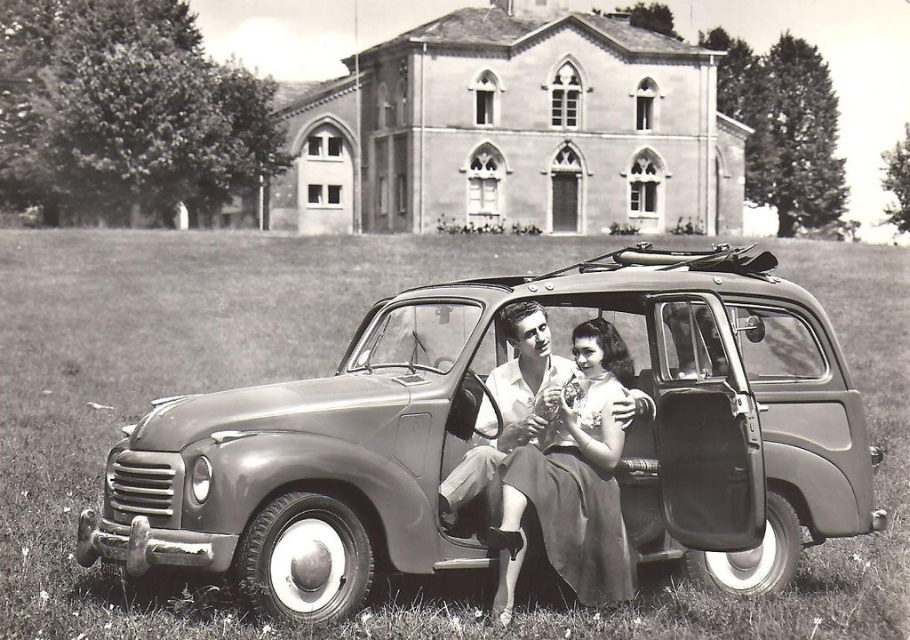
You are a photographer trying to capture a photo of the metallic gray car at center and the smooth fabric dress at center from above. Considering their heights, which one would be more likely to be fully visible in the aerial shot?

The metallic gray car at center has a greater height compared to the smooth fabric dress at center, so the dress would be more likely to be fully visible in the aerial shot since it is shorter and less likely to be obscured by the taller car.

You are a photographer who wants to capture both the metallic gray car at center and the smooth fabric dress at center in one frame. Since the camera has a limited focus range, which object should you prioritize focusing on to ensure it appears sharp?

The metallic gray car at center is larger in size than the smooth fabric dress at center, so you should prioritize focusing on the metallic gray car at center to ensure it appears sharp.